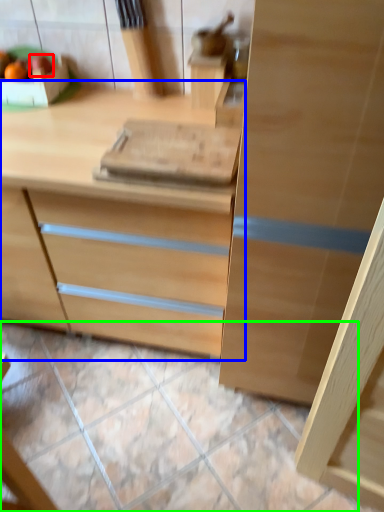
Question: Estimate the real-world distances between objects in this image. Which object is farther from fruit (highlighted by a red box), chest of drawers (highlighted by a blue box) or tile (highlighted by a green box)?

Choices:
 (A) chest of drawers
 (B) tile

Answer: (B)